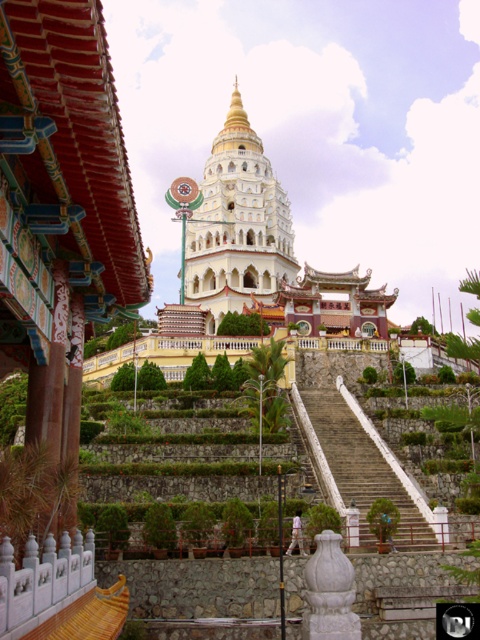
Is point (240, 108) less distant than point (335, 467)?

No, (240, 108) is behind (335, 467).

Is white stone pagoda at center closer to camera compared to white stone stairs at center?

No.

Where is `white stone pagoda at center`? Image resolution: width=480 pixels, height=640 pixels. white stone pagoda at center is located at coordinates (238, 225).

Find the location of a particular element. The width and height of the screenshot is (480, 640). white stone pagoda at center is located at coordinates (238, 225).